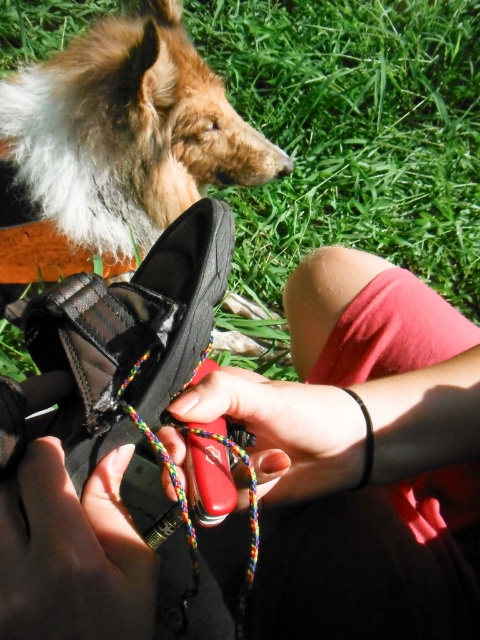
You are a gardener who needs to place a new red matte knife at center in the scene. Where should you position it so that it aligns with the existing green grass at upper center?

The red matte knife at center should be placed to the left of the green grass at upper center since the green grass at upper center is to the right of the red matte knife at center.